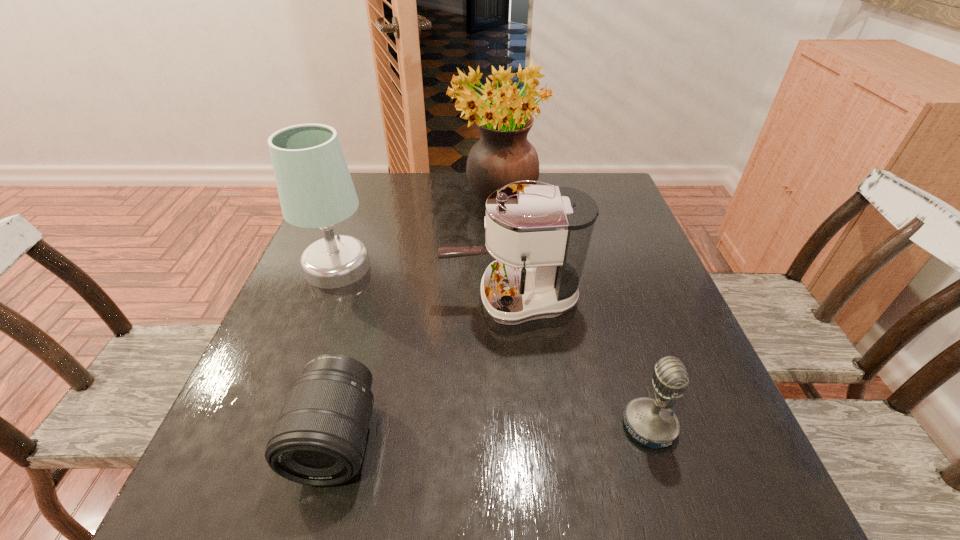
Locate an element on the screen. Image resolution: width=960 pixels, height=540 pixels. the farthest object is located at coordinates (503, 155).

What are the coordinates of `lampshade` in the screenshot? It's located at (315, 188).

Find the location of a particular element. This screenshot has width=960, height=540. the third shortest object is located at coordinates (539, 235).

Find the location of `the rightmost object`. the rightmost object is located at coordinates (652, 423).

The height and width of the screenshot is (540, 960). I want to click on the fourth tallest object, so click(x=652, y=423).

Identify the location of the shortest object. (319, 439).

The image size is (960, 540). Identify the location of vacant space situated 0.070m on the front of the flower arrangement. (x=500, y=250).

Locate an element on the screen. vacant position located on the base of the lampshade is located at coordinates (412, 267).

You are a GUI agent. You are given a task and a screenshot of the screen. Output one action in this format:
    pyautogui.click(x=<x>, y=<y>)
    Task: Click on the vacant position located 0.100m on the front-facing side of the coffee maker
    
    Given the screenshot: What is the action you would take?
    pyautogui.click(x=396, y=299)

The image size is (960, 540). Identify the location of vacant space positioned on the front-facing side of the coffee maker. (383, 299).